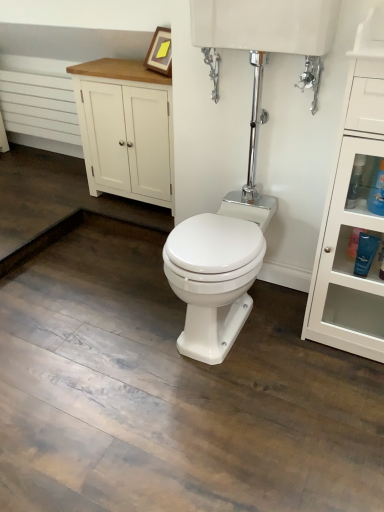
Question: Can you confirm if white painted wood cabinet at upper left is shorter than white glossy cabinet at right?

Choices:
 (A) no
 (B) yes

Answer: (B)

Question: Is white painted wood cabinet at upper left at the left side of white glossy cabinet at right?

Choices:
 (A) no
 (B) yes

Answer: (B)

Question: Is white painted wood cabinet at upper left thinner than white glossy cabinet at right?

Choices:
 (A) no
 (B) yes

Answer: (B)

Question: From the image's perspective, would you say white painted wood cabinet at upper left is positioned over white glossy cabinet at right?

Choices:
 (A) no
 (B) yes

Answer: (B)

Question: Does white painted wood cabinet at upper left turn towards white glossy cabinet at right?

Choices:
 (A) no
 (B) yes

Answer: (A)

Question: Considering their positions, is blue glossy bottle at right located in front of or behind white glossy tank at upper center?

Choices:
 (A) front
 (B) behind

Answer: (B)

Question: Visually, is blue glossy bottle at right positioned to the left or to the right of white glossy tank at upper center?

Choices:
 (A) right
 (B) left

Answer: (A)

Question: Looking at their shapes, would you say blue glossy bottle at right is wider or thinner than white glossy tank at upper center?

Choices:
 (A) wide
 (B) thin

Answer: (B)

Question: Based on their sizes in the image, would you say blue glossy bottle at right is bigger or smaller than white glossy tank at upper center?

Choices:
 (A) big
 (B) small

Answer: (B)

Question: In terms of width, does white glossy cabinet at right look wider or thinner when compared to white painted wood cabinet at upper left?

Choices:
 (A) wide
 (B) thin

Answer: (A)

Question: Is white glossy cabinet at right spatially inside white painted wood cabinet at upper left, or outside of it?

Choices:
 (A) outside
 (B) inside

Answer: (A)

Question: Is white glossy cabinet at right in front of or behind white painted wood cabinet at upper left in the image?

Choices:
 (A) behind
 (B) front

Answer: (B)

Question: Considering the relative positions of white glossy cabinet at right and white painted wood cabinet at upper left in the image provided, is white glossy cabinet at right to the left or to the right of white painted wood cabinet at upper left?

Choices:
 (A) left
 (B) right

Answer: (B)

Question: In the image, is white painted wood cabinet at upper left on the left side or the right side of blue glossy bottle at right?

Choices:
 (A) left
 (B) right

Answer: (A)

Question: Is white painted wood cabinet at upper left taller or shorter than blue glossy bottle at right?

Choices:
 (A) tall
 (B) short

Answer: (A)